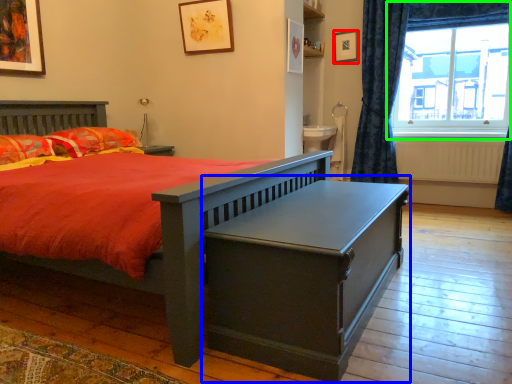
Question: Which is nearer to the picture frame (highlighted by a red box)? table (highlighted by a blue box) or window (highlighted by a green box).

Choices:
 (A) table
 (B) window

Answer: (B)